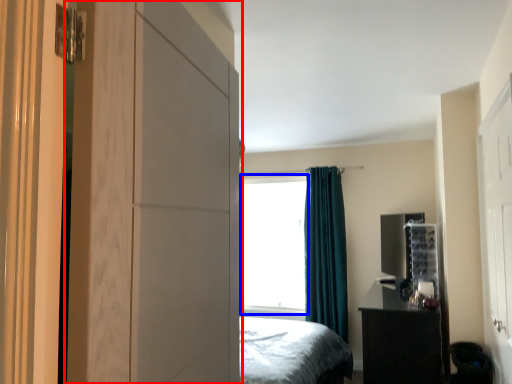
Question: Which object appears farthest to the camera in this image, dresser (highlighted by a red box) or window screen (highlighted by a blue box)?

Choices:
 (A) dresser
 (B) window screen

Answer: (B)